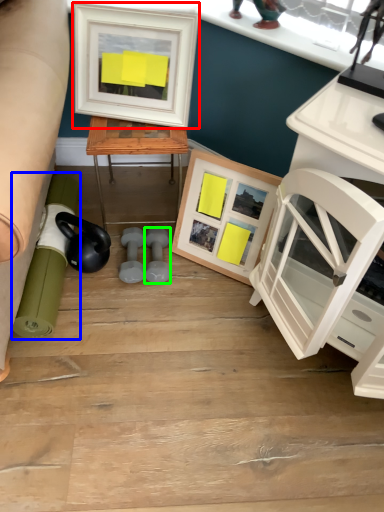
Question: Which object is positioned farthest from picture frame (highlighted by a red box)? Select from rolling pin (highlighted by a blue box) and dumbbell (highlighted by a green box).

Choices:
 (A) rolling pin
 (B) dumbbell

Answer: (A)